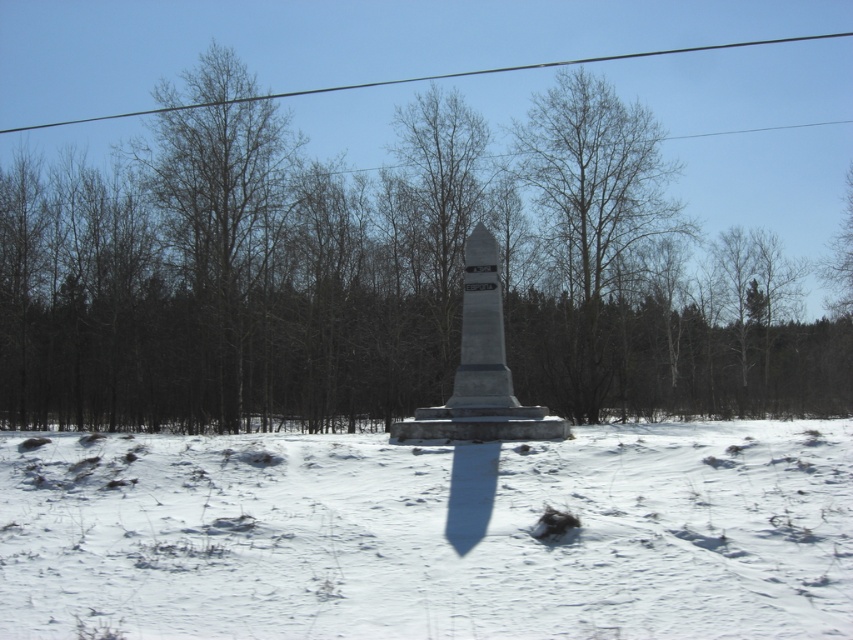
Does white powdery snow at center appear on the right side of gray stone monument at center?

Incorrect, white powdery snow at center is not on the right side of gray stone monument at center.

Is white powdery snow at center taller than gray stone monument at center?

Correct, white powdery snow at center is much taller as gray stone monument at center.

What do you see at coordinates (431, 534) in the screenshot? Image resolution: width=853 pixels, height=640 pixels. I see `white powdery snow at center` at bounding box center [431, 534].

Identify the location of white powdery snow at center. (431, 534).

Does bare wood tree at left have a smaller size compared to black wire at upper center?

Yes.

Between bare wood tree at left and black wire at upper center, which one is positioned higher?

black wire at upper center is above.

Is point (223, 161) closer to camera compared to point (602, 60)?

Yes, point (223, 161) is in front of point (602, 60).

Locate an element on the screen. bare wood tree at left is located at coordinates (219, 237).

Which is more to the left, white powdery snow at center or black wire at upper center?

white powdery snow at center

Between point (323, 570) and point (418, 76), which one is positioned in front?

Point (323, 570) is more forward.

Is point (270, 488) closer to viewer compared to point (639, 54)?

Yes, it is in front of point (639, 54).

Where is `white powdery snow at center`? This screenshot has width=853, height=640. white powdery snow at center is located at coordinates (431, 534).